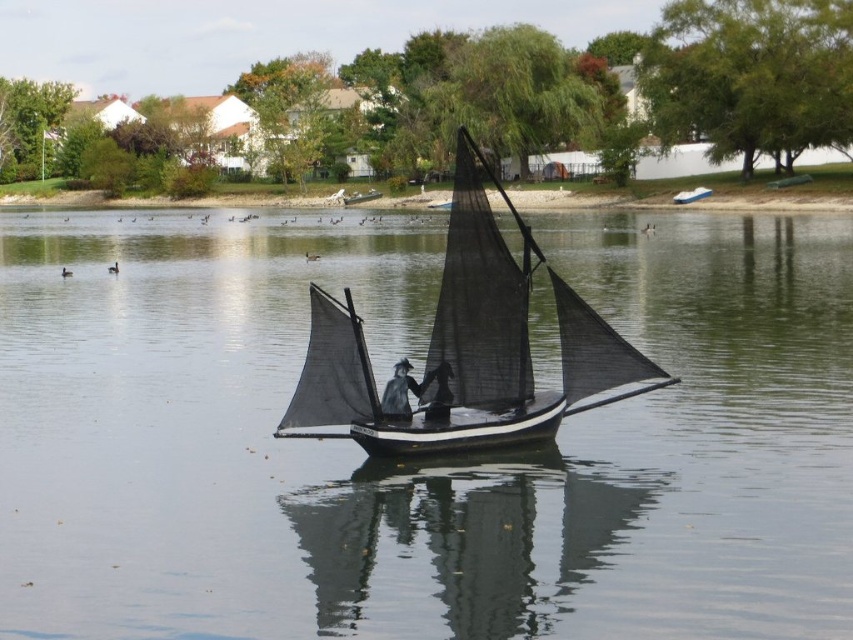
Question: Which point appears farthest from the camera in this image?

Choices:
 (A) (312, 435)
 (B) (688, 198)
 (C) (755, 445)
 (D) (393, 381)

Answer: (B)

Question: Does transparent water at center come in front of black mesh sailboat at center?

Choices:
 (A) no
 (B) yes

Answer: (B)

Question: Based on their relative distances, which object is nearer to the dark gray fabric hat at center?

Choices:
 (A) metallic blue sailboat at center
 (B) black mesh sailboat at center
 (C) transparent water at center

Answer: (B)

Question: Which of the following is the farthest from the observer?

Choices:
 (A) (721, 497)
 (B) (463, 426)

Answer: (B)

Question: Is transparent water at center positioned at the back of dark gray fabric hat at center?

Choices:
 (A) yes
 (B) no

Answer: (B)

Question: Does transparent water at center appear under metallic blue sailboat at center?

Choices:
 (A) yes
 (B) no

Answer: (A)